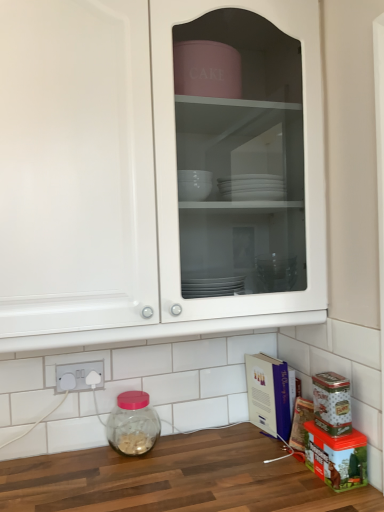
Question: Considering the positions of cardboard box at lower right and transparent glass jar at lower left in the image, is cardboard box at lower right wider or thinner than transparent glass jar at lower left?

Choices:
 (A) wide
 (B) thin

Answer: (A)

Question: Does point click(x=278, y=415) appear closer or farther from the camera than point click(x=130, y=424)?

Choices:
 (A) closer
 (B) farther

Answer: (B)

Question: Which is nearer to the cardboard box at lower right?

Choices:
 (A) transparent glass jar at lower left
 (B) white glossy cabinet at upper center
 (C) white plastic electric outlet at lower left

Answer: (A)

Question: Which object is the farthest from the white glossy cabinet at upper center?

Choices:
 (A) white plastic electric outlet at lower left
 (B) transparent glass jar at lower left
 (C) cardboard box at lower right

Answer: (C)